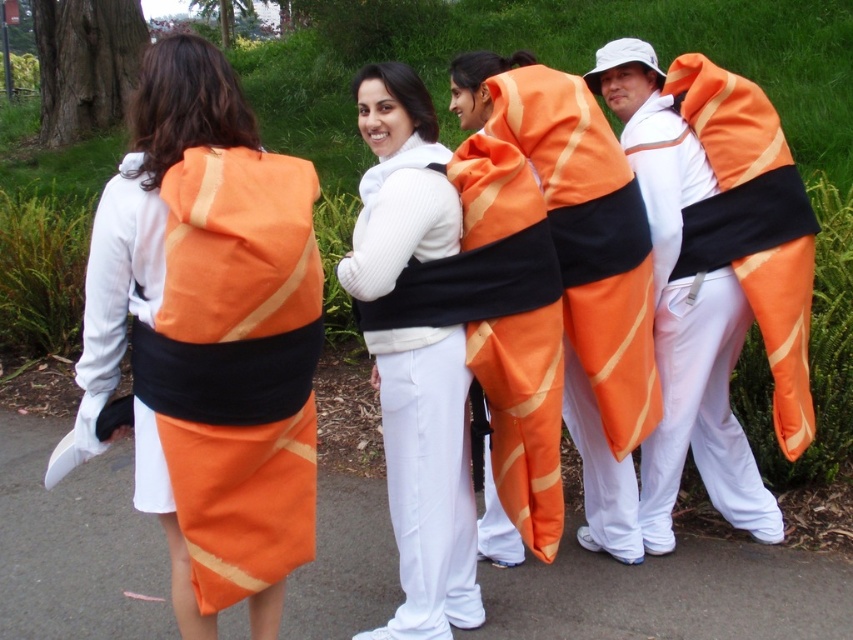
Does matte orange fabric sushi roll at back have a smaller size compared to matte orange sushi roll at center?

Indeed, matte orange fabric sushi roll at back has a smaller size compared to matte orange sushi roll at center.

Who is positioned more to the left, matte orange fabric sushi roll at back or matte orange sushi roll at center?

From the viewer's perspective, matte orange fabric sushi roll at back appears more on the left side.

Between point (229, 90) and point (689, 145), which one is positioned behind?

The point (689, 145) is behind.

You are a GUI agent. You are given a task and a screenshot of the screen. Output one action in this format:
    pyautogui.click(x=<x>, y=<y>)
    Task: Click on the matte orange fabric sushi roll at back
    Image resolution: width=853 pixels, height=640 pixels.
    Given the screenshot: What is the action you would take?
    pyautogui.click(x=212, y=333)

Which is behind, point (401, 452) or point (625, 113)?

Positioned behind is point (625, 113).

Does point (378, 289) come farther from viewer compared to point (651, 208)?

No, it is in front of (651, 208).

Between point (442, 493) and point (587, 80), which one is positioned in front?

Point (442, 493) is more forward.

The width and height of the screenshot is (853, 640). Identify the location of matte white sweater at center. (427, 477).

Describe the element at coordinates (212, 333) in the screenshot. I see `matte orange fabric sushi roll at back` at that location.

Between point (202, 211) and point (403, 228), which one is positioned in front?

Point (202, 211) is in front.

Where is `matte orange fabric sushi roll at back`? The height and width of the screenshot is (640, 853). matte orange fabric sushi roll at back is located at coordinates (212, 333).